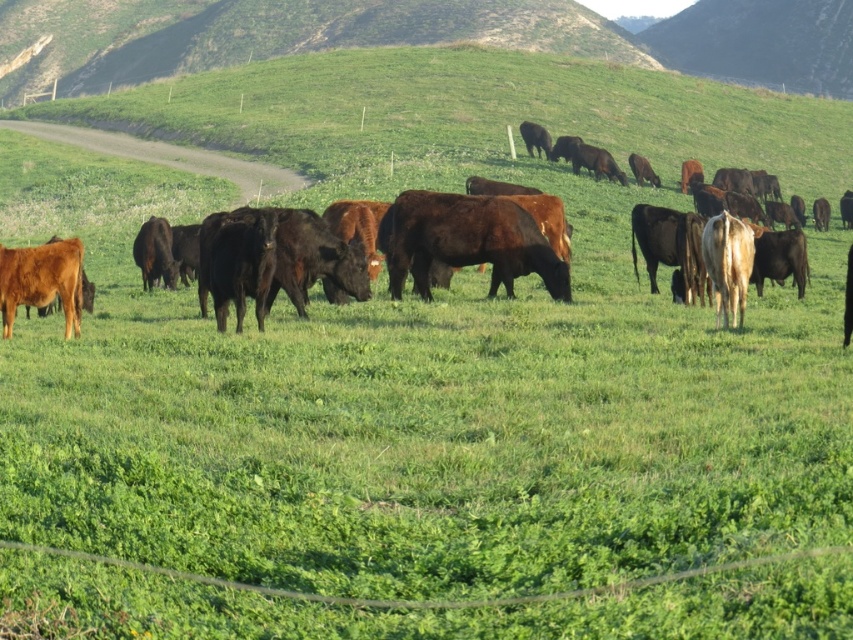
Question: Can you confirm if brown glossy bull at center is bigger than brown glossy cow at lower left?

Choices:
 (A) no
 (B) yes

Answer: (B)

Question: Which point is farther to the camera?

Choices:
 (A) brown glossy cows at center
 (B) brown glossy bull at center
 (C) brown glossy cow at lower left

Answer: (B)

Question: Is brown glossy bull at center bigger than brown glossy cow at lower left?

Choices:
 (A) yes
 (B) no

Answer: (A)

Question: Which of the following is the farthest from the observer?

Choices:
 (A) (393, 236)
 (B) (297, 179)

Answer: (B)

Question: Is brown glossy bull at center above brown glossy cows at center?

Choices:
 (A) yes
 (B) no

Answer: (B)

Question: Which is farther from the brown glossy cows at center?

Choices:
 (A) brown glossy bull at center
 (B) brown glossy cow at lower left

Answer: (B)